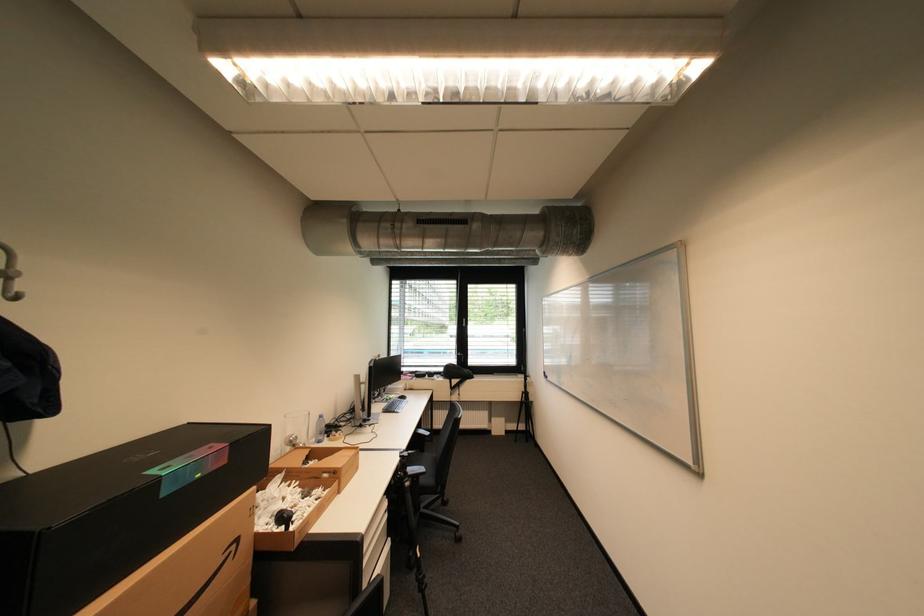
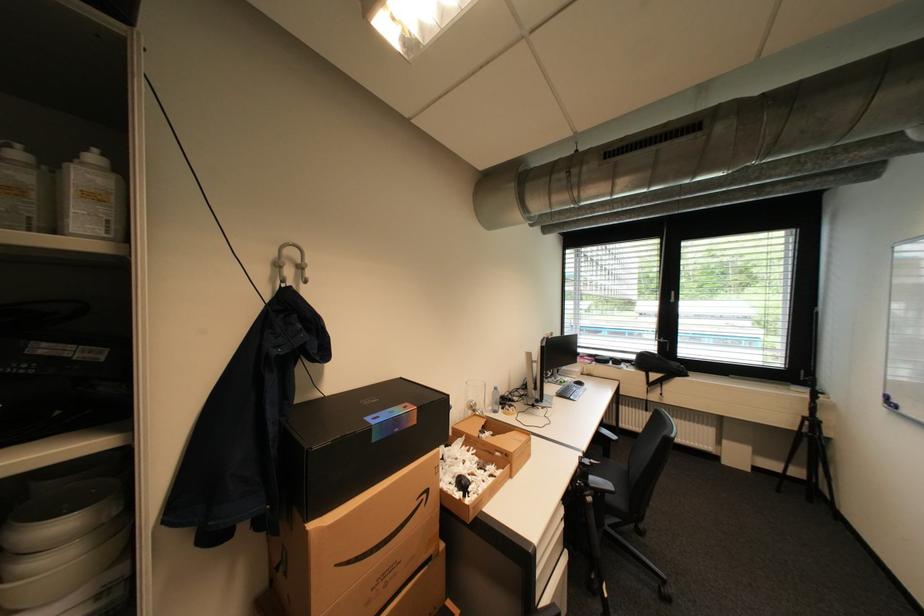
Question: I am providing you with two images of the same scene from different viewpoints. Which of the following objects are not visible in image2?

Choices:
 (A) black tripod
 (B) window handle
 (C) chair armrest
 (D) none of these

Answer: (D)